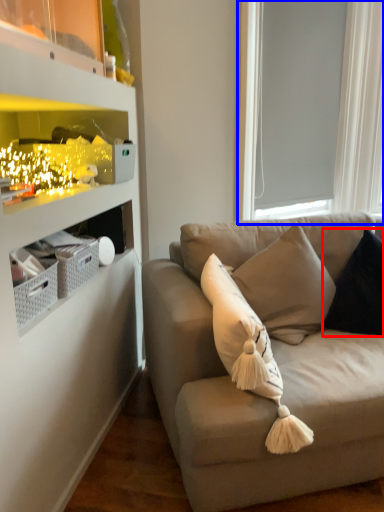
Question: Which object appears farthest to the camera in this image, pillow (highlighted by a red box) or window screen (highlighted by a blue box)?

Choices:
 (A) pillow
 (B) window screen

Answer: (B)